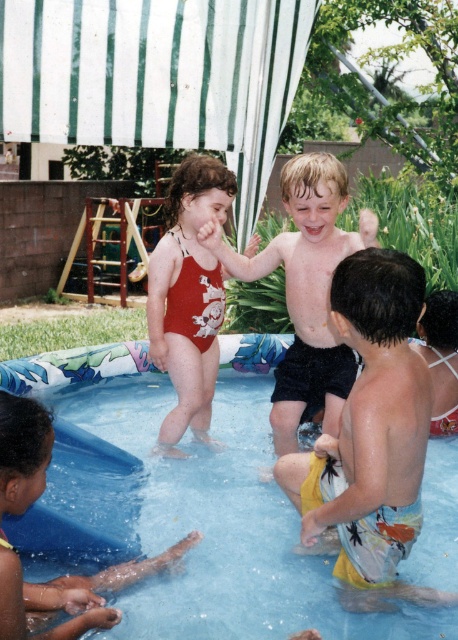
You are a photographer standing at the center of the backyard pool party scene. You want to capture a photo of the yellow printed shorts at lower right. According to the coordinates provided, where should you aim your camera to ensure the shorts are centered in the frame?

To center the yellow printed shorts at lower right in your photo, aim your camera at the coordinates point (371, 435) as that is the 2D location of the yellow printed shorts at lower right.

You are a parent at the pool party. You see the smooth black shorts at center and the yellow rubber band at lower left. Which object is positioned higher in the image?

The smooth black shorts at center is above the yellow rubber band at lower left, so the smooth black shorts at center is positioned higher.

You are a photographer trying to capture a photo of the blue rubber pool at center and the yellow printed shorts at lower right. If you want both objects to be in the same frame, should you adjust your camera upwards or downwards?

The blue rubber pool at center is below yellow printed shorts at lower right, so to include both in the frame, you should adjust your camera upwards to capture the lower position of the pool and the higher position of the shorts.